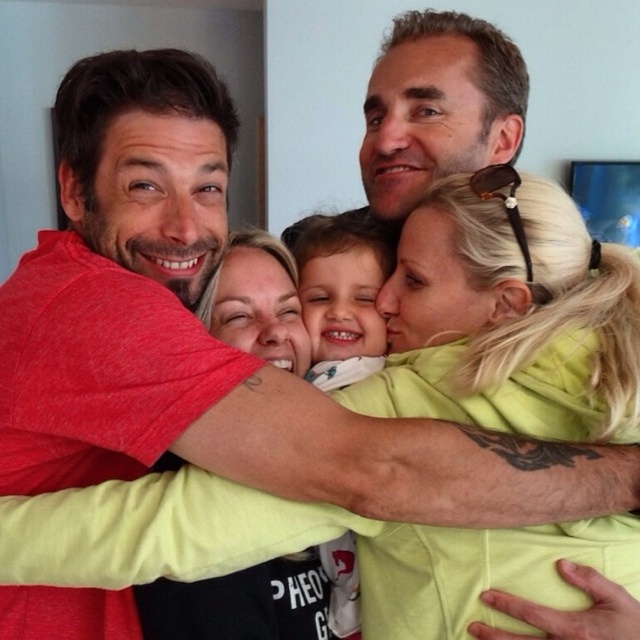
You are a photographer trying to capture the group hug without any distractions. You notice the white soft fabric at center and the smooth white baby at center. Which object should you adjust to ensure the baby is fully visible in the photo?

The white soft fabric at center is above the smooth white baby at center, so adjusting the white soft fabric at center would allow the baby to be fully visible.

You are standing in the living room and want to reach the point at coordinates (435,573). If you can move 30 inches in one step, how many steps do you need to take to reach that point?

The point at coordinates (435,573) is 31.10 inches away from you. Since you can move 30 inches in one step, you would need to take 2 steps to reach that point.

You are a photographer trying to capture the group hug in the image. You want to ensure that both the blonde hair at upper right and the smooth white baby at center are fully visible in your shot. Based on their widths, which object should you prioritize framing first to avoid cropping?

The smooth white baby at center has a smaller width compared to the blonde hair at upper right. Therefore, you should prioritize framing the smooth white baby at center first to ensure it fits entirely within the frame before adjusting for the wider blonde hair at upper right.